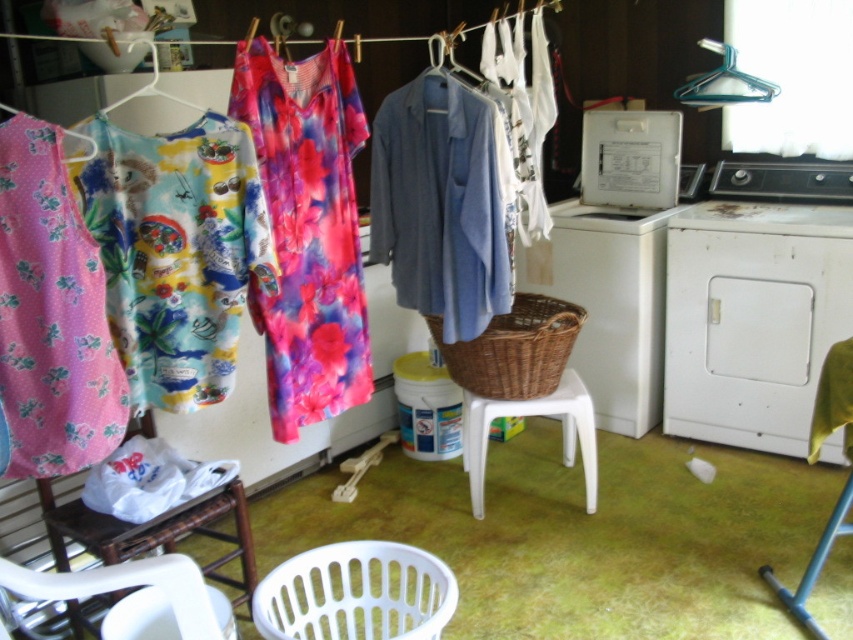
You are standing in the laundry room and need to place a new item exactly at the center of the room. The room has a white plastic washing machine at center. Can you determine if the washing machine is already occupying the center point?

The white plastic washing machine at center is located at point (614, 260), which is the center of the room. Therefore, the washing machine is already occupying the center point.